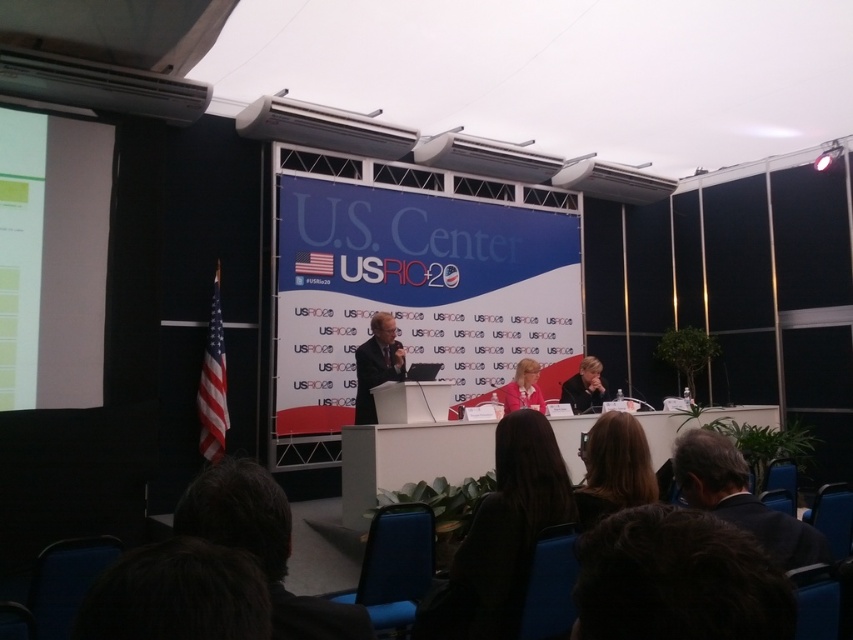
Based on the photo, you are an event organizer at the USRIO 2014 event. You need to arrange a photo shoot for the attendees. The photographer wants to ensure that both the dark brown hair at lower left and the dark suit at center are visible in the frame. Given their sizes, which object should be placed closer to the camera to ensure both are visible without cropping?

The dark brown hair at lower left occupies less space than the dark suit at center. To ensure both are visible without cropping, the dark brown hair at lower left should be placed closer to the camera since it is smaller and requires less space in the frame compared to the dark suit at center.

You are an event planner standing at the stage edge and need to move from the dark brown hair at lower left to the dark suit at center. Is the distance sufficient for you to walk comfortably without needing to detour around any obstacles?

The distance between dark brown hair at lower left and dark suit at center is 3.63 meters, which is more than enough for comfortable walking without detouring around obstacles.

You are an attendee at the USRIO 2014 event at the U.S. Center. You want to take a photo of the speaker at the podium without any obstructions. Is the white matte projection screen at center blocking your view of the speaker?

The white matte projection screen at center is located at point (x=416, y=291), which is centrally positioned. Since the speaker is at the podium centrally on the stage, the screen might be directly in front of the speaker, potentially blocking your view. However, without specific spatial relations beyond coordinates, it is uncertain. The answer requires knowing if the screen is behind or in front of the podium.